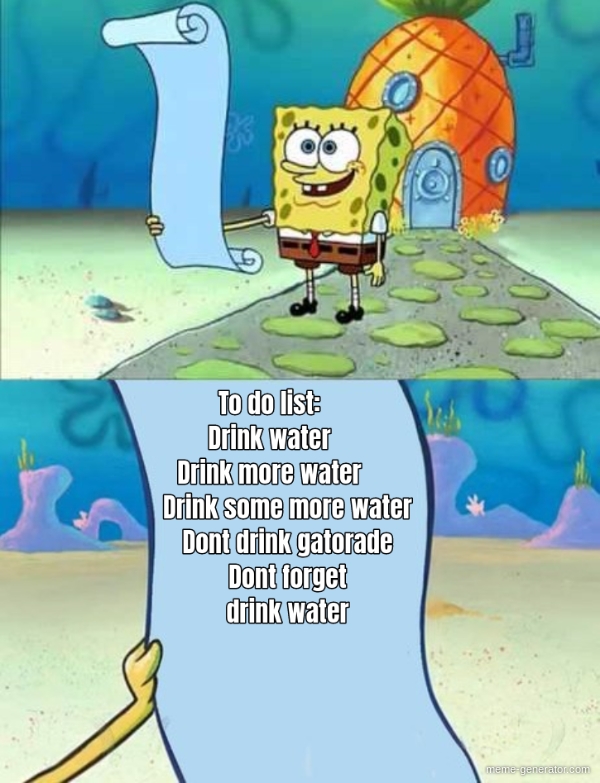
Find the location of a particular element. This screenshot has width=600, height=783. window is located at coordinates (405, 95).